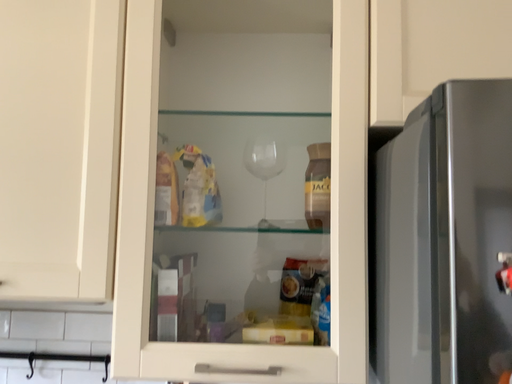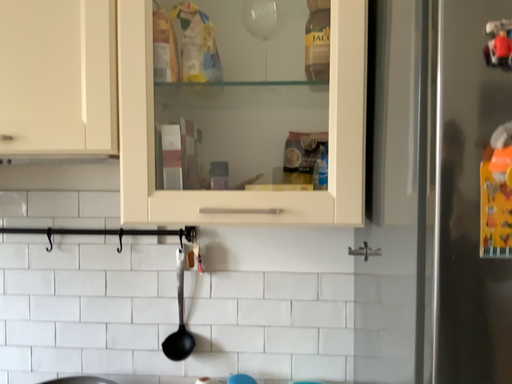
Question: How did the camera likely rotate when shooting the video?

Choices:
 (A) rotated downward
 (B) rotated upward

Answer: (A)